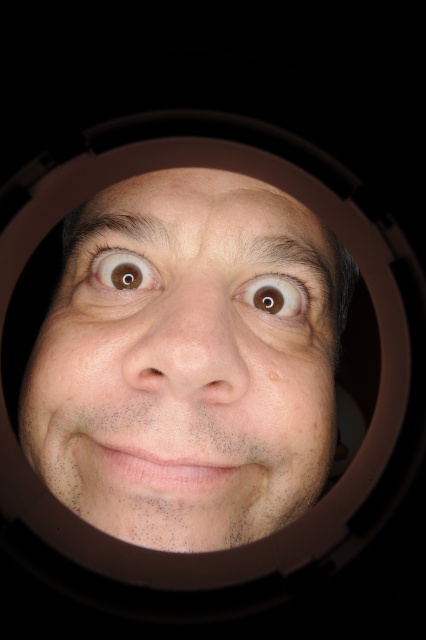
You are a photographer adjusting the focus of your camera. The camera lens has a circular frame with a gradient effect. You notice a point at coordinates (187, 364). What is located at this point?

At point (187, 364) lies smooth skin face at center.

Based on the scene description, is the smooth skin face at center positioned to the left or right of the brown matte eye at center?

The smooth skin face at center is to the left of the brown matte eye at center.

Consider the image. The brown matte eye at center is located at coordinates approximately where? Please provide the coordinates in the format of a point like 0.463, 0.643

The brown matte eye at center is located at point [273,296].